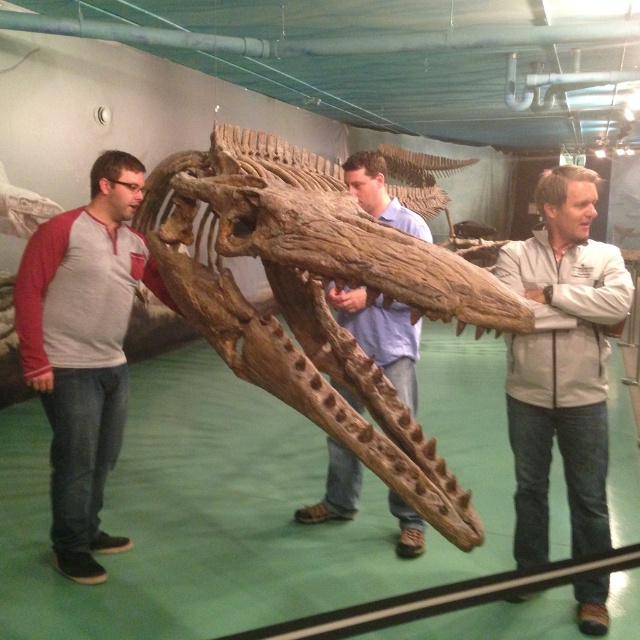
Question: From the image, what is the correct spatial relationship of matte gray shirt at left in relation to wooden skull at center?

Choices:
 (A) above
 (B) below

Answer: (B)

Question: Estimate the real-world distances between objects in this image. Which object is closer to the wooden skull at center?

Choices:
 (A) matte gray shirt at left
 (B) white matte jacket at center

Answer: (B)

Question: Among these points, which one is farthest from the camera?

Choices:
 (A) (365, 204)
 (B) (588, 230)

Answer: (A)

Question: Which object is positioned farthest from the white matte jacket at center?

Choices:
 (A) brown rough skull at center
 (B) wooden skull at center

Answer: (A)

Question: From the image, what is the correct spatial relationship of brown rough skull at center in relation to white matte jacket at center?

Choices:
 (A) above
 (B) below

Answer: (A)

Question: Considering the relative positions of brown rough skull at center and white matte jacket at center in the image provided, where is brown rough skull at center located with respect to white matte jacket at center?

Choices:
 (A) below
 (B) above

Answer: (B)